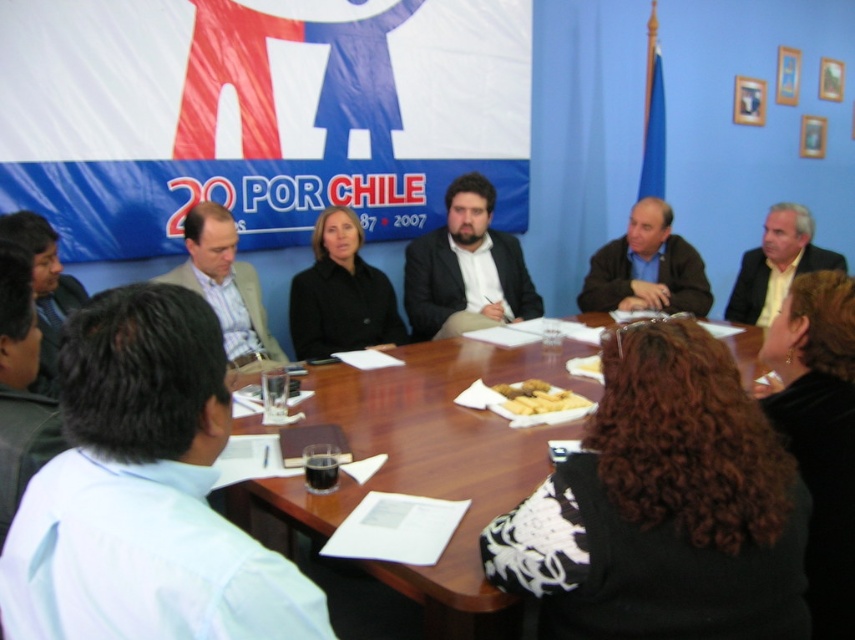
You are a photographer taking a picture of the meeting participants. You need to ensure that the white shirt at lower left and the dark brown leather jacket at right are both visible in the frame. Based on their positions, which one should be placed closer to the left side of the photo?

The white shirt at lower left should be placed closer to the left side of the photo since it is positioned on the left side of the dark brown leather jacket at right.

You are standing at the center of the room where the rectangular wooden table is located. You need to locate the white shirt at lower left. Which direction should you look to find it?

You should look to the lower left direction to find the white shirt at lower left since it is located at point (144, 493).